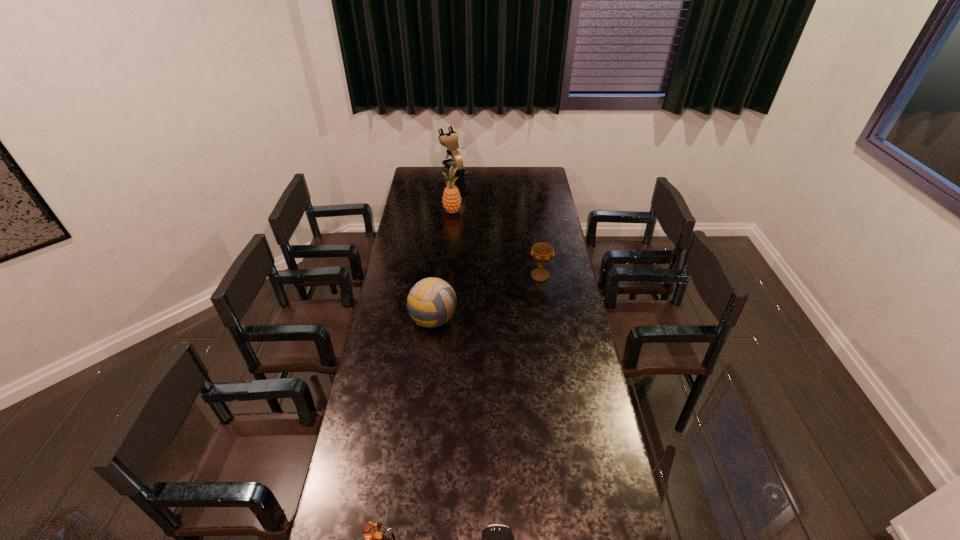
Locate an element on the screen. The width and height of the screenshot is (960, 540). the fourth closest object to the volleyball is located at coordinates (496, 539).